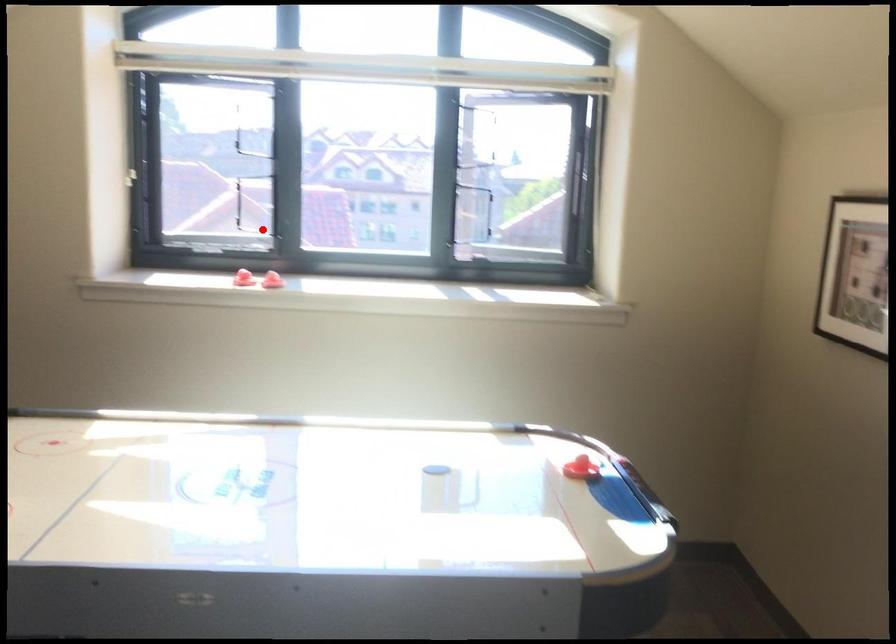
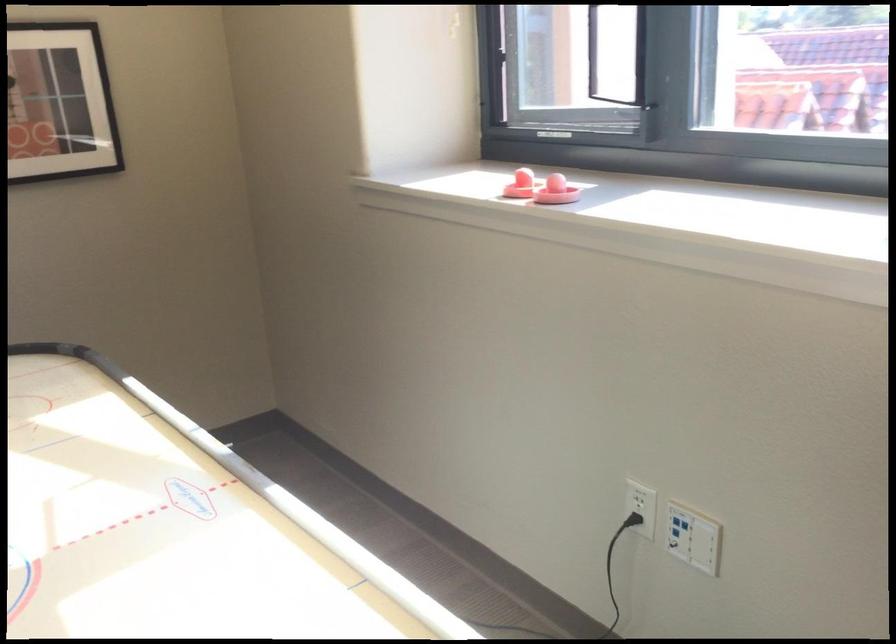
Question: I am providing you with two images of the same scene from different viewpoints. Given a red point in image1, look at the same physical point in image2. Is it:

Choices:
 (A) Closer to the viewpoint
 (B) Farther from the viewpoint

Answer: (A)